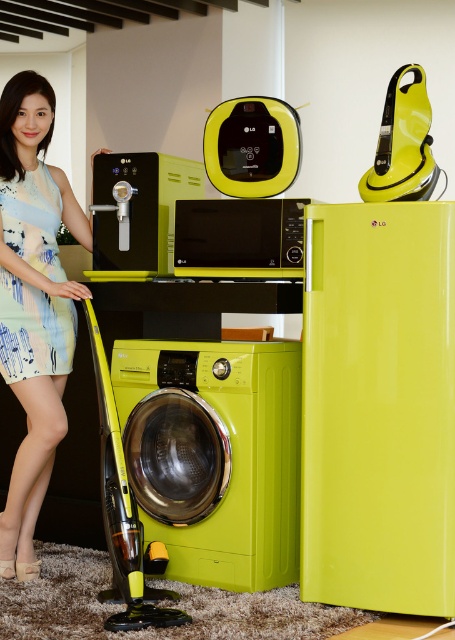
Question: Does lime glossy refrigerator at center have a lesser width compared to glossy lime green washing machine at lower center?

Choices:
 (A) no
 (B) yes

Answer: (B)

Question: Which object appears farthest from the camera in this image?

Choices:
 (A) printed fabric dress at lower left
 (B) glossy lime green washing machine at lower center
 (C) light blue printed dress at left

Answer: (C)

Question: Which point appears farthest from the camera in this image?

Choices:
 (A) (127, 196)
 (B) (35, 240)

Answer: (A)

Question: Is printed fabric dress at lower left in front of matte black microwave at center?

Choices:
 (A) yes
 (B) no

Answer: (A)

Question: Is lime glossy refrigerator at center closer to the viewer compared to glossy lime green washing machine at lower center?

Choices:
 (A) yes
 (B) no

Answer: (A)

Question: Which point is closer to the camera?

Choices:
 (A) glossy lime green washing machine at lower center
 (B) light blue printed dress at left
 (C) glossy plastic washing machine at lower center
 (D) matte black microwave at center

Answer: (A)